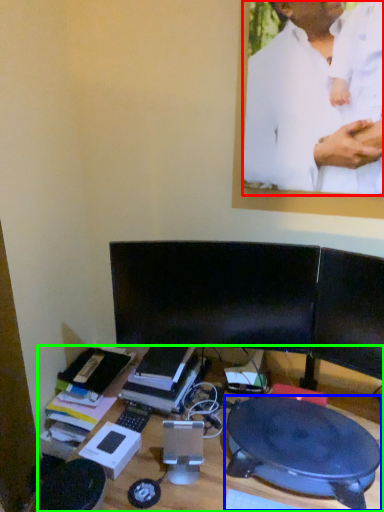
Question: Based on their relative distances, which object is nearer to man (highlighted by a red box)? Choose from round table (highlighted by a blue box) and desk (highlighted by a green box).

Choices:
 (A) round table
 (B) desk

Answer: (A)